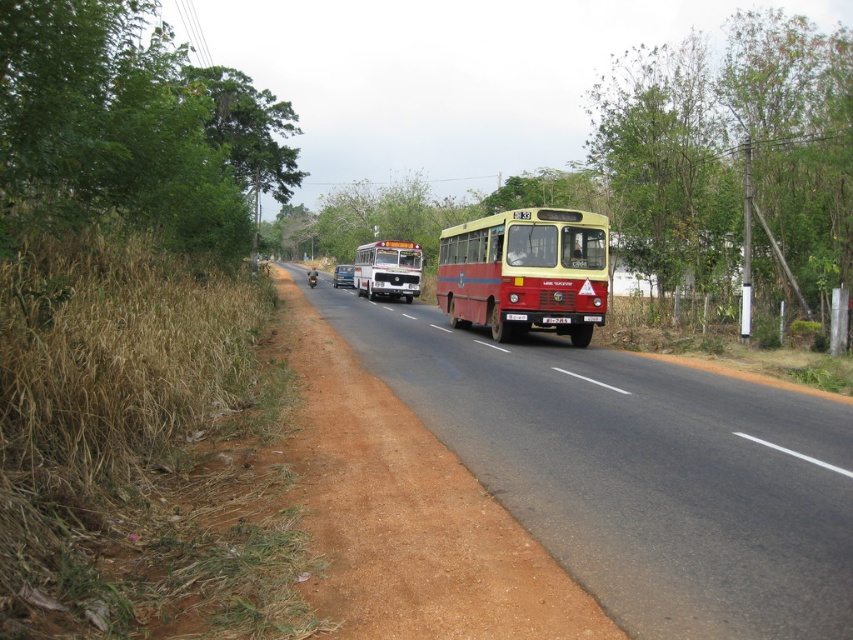
Between point (694, 211) and point (486, 536), which one is positioned in front?

Point (486, 536) is in front.

Is point (848, 128) positioned behind point (486, 561)?

Yes, it is behind point (486, 561).

You are a GUI agent. You are given a task and a screenshot of the screen. Output one action in this format:
    pyautogui.click(x=<x>, y=<y>)
    Task: Click on the green leafy tree at center
    The height and width of the screenshot is (640, 853).
    Given the screenshot: What is the action you would take?
    pyautogui.click(x=732, y=156)

You are a GUI agent. You are given a task and a screenshot of the screen. Output one action in this format:
    pyautogui.click(x=<x>, y=<y>)
    Task: Click on the green leafy tree at left
    The height and width of the screenshot is (640, 853).
    Given the screenshot: What is the action you would take?
    pyautogui.click(x=131, y=128)

Is the position of green leafy tree at left less distant than that of red matte bus at center?

Yes, green leafy tree at left is in front of red matte bus at center.

What do you see at coordinates (131, 128) in the screenshot? I see `green leafy tree at left` at bounding box center [131, 128].

I want to click on green leafy tree at left, so pos(131,128).

Which is more to the left, green leafy tree at center or green leafy tree at left?

green leafy tree at left is more to the left.

I want to click on green leafy tree at center, so click(732, 156).

You are a GUI agent. You are given a task and a screenshot of the screen. Output one action in this format:
    pyautogui.click(x=<x>, y=<y>)
    Task: Click on the green leafy tree at center
    The height and width of the screenshot is (640, 853).
    Given the screenshot: What is the action you would take?
    pyautogui.click(x=732, y=156)